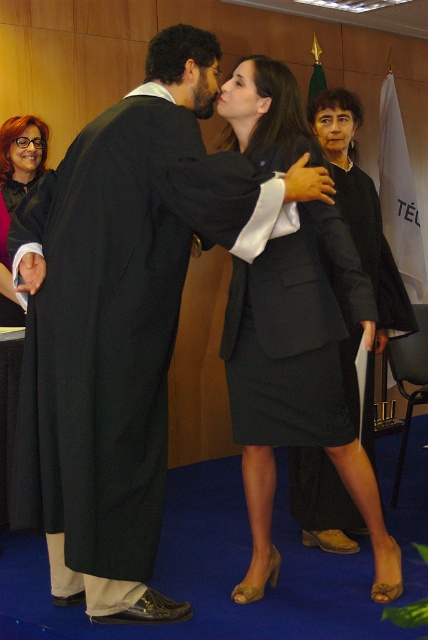
Question: Which is nearer to the black matte suit at center?

Choices:
 (A) black fabric skirt at center
 (B) matte black suit at center

Answer: (B)

Question: Is black matte suit at center wider than black fabric skirt at center?

Choices:
 (A) yes
 (B) no

Answer: (B)

Question: Estimate the real-world distances between objects in this image. Which object is closer to the black fabric skirt at center?

Choices:
 (A) black matte suit at center
 (B) matte black suit at center

Answer: (B)

Question: Which object is the closest to the matte black suit at center?

Choices:
 (A) black matte suit at center
 (B) matte black gown at left

Answer: (A)

Question: Does matte black suit at center appear over black fabric skirt at center?

Choices:
 (A) yes
 (B) no

Answer: (B)

Question: Does matte black suit at center have a larger size compared to matte black gown at left?

Choices:
 (A) yes
 (B) no

Answer: (A)